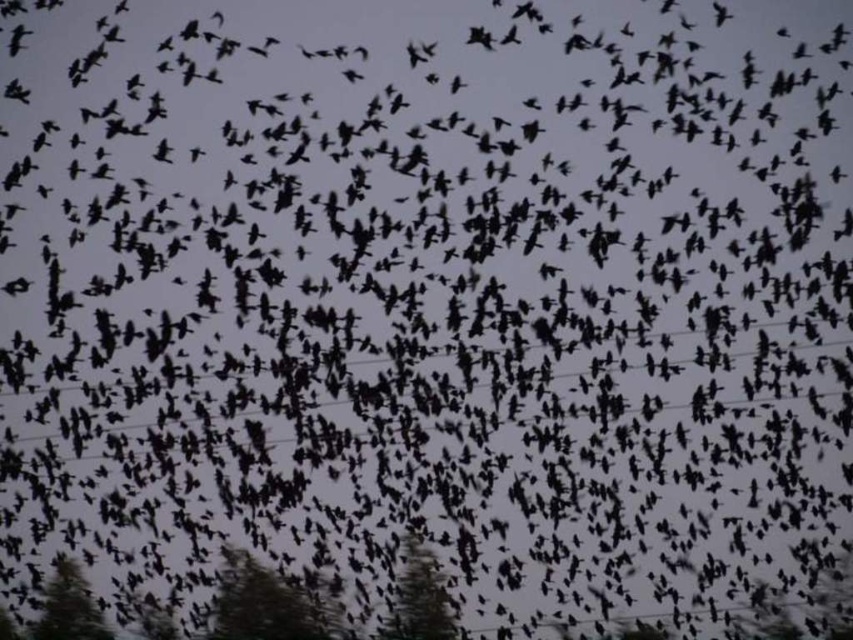
Who is positioned more to the right, green matte tree at lower center or green textured tree at center?

green textured tree at center is more to the right.

Which is more to the left, green matte tree at lower center or green textured tree at center?

green matte tree at lower center

Between point (274, 628) and point (434, 602), which one is positioned in front?

Point (274, 628) is in front.

At what (x,y) coordinates should I click in order to perform the action: click on green matte tree at lower center. Please return your answer as a coordinate pair (x, y). The height and width of the screenshot is (640, 853). Looking at the image, I should click on (264, 604).

Between green matte tree at lower center and green matte tree at lower left, which one appears on the right side from the viewer's perspective?

Positioned to the right is green matte tree at lower center.

Is point (277, 593) positioned after point (79, 576)?

No, (277, 593) is in front of (79, 576).

This screenshot has height=640, width=853. What do you see at coordinates (264, 604) in the screenshot?
I see `green matte tree at lower center` at bounding box center [264, 604].

This screenshot has width=853, height=640. I want to click on green matte tree at lower center, so click(x=264, y=604).

Is green textured tree at center taller than green matte tree at lower left?

Yes, green textured tree at center is taller than green matte tree at lower left.

Who is more distant from viewer, (428, 627) or (48, 637)?

The point (48, 637) is more distant.

At what (x,y) coordinates should I click in order to perform the action: click on green textured tree at center. Please return your answer as a coordinate pair (x, y). The height and width of the screenshot is (640, 853). Looking at the image, I should click on (421, 596).